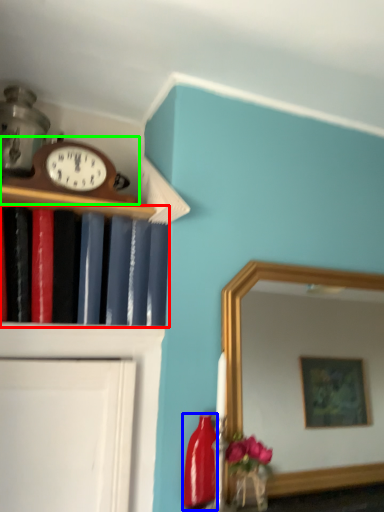
Question: Estimate the real-world distances between objects in this image. Which object is farther from book (highlighted by a red box), bottle (highlighted by a blue box) or wall clock (highlighted by a green box)?

Choices:
 (A) bottle
 (B) wall clock

Answer: (A)